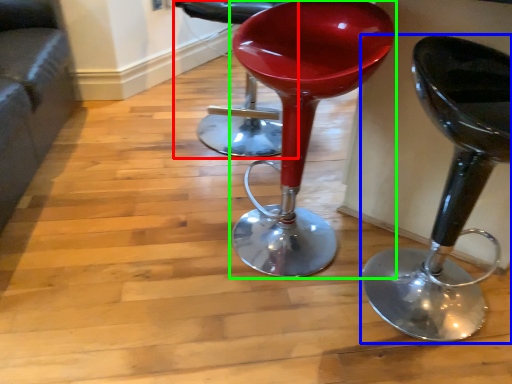
Question: Considering the real-world distances, which object is closest to chair (highlighted by a red box)? stool (highlighted by a blue box) or stool (highlighted by a green box).

Choices:
 (A) stool
 (B) stool

Answer: (B)